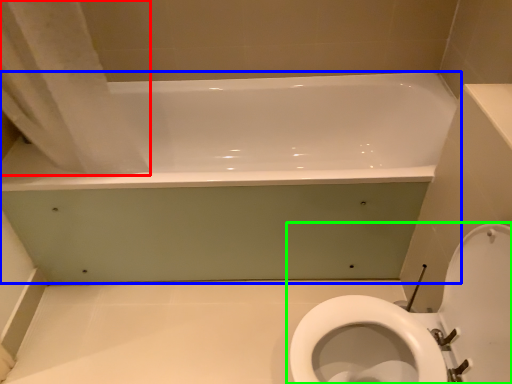
Question: Which object is the closest to the shower curtain (highlighted by a red box)? Choose among these: bathtub (highlighted by a blue box) or toilet (highlighted by a green box).

Choices:
 (A) bathtub
 (B) toilet

Answer: (A)